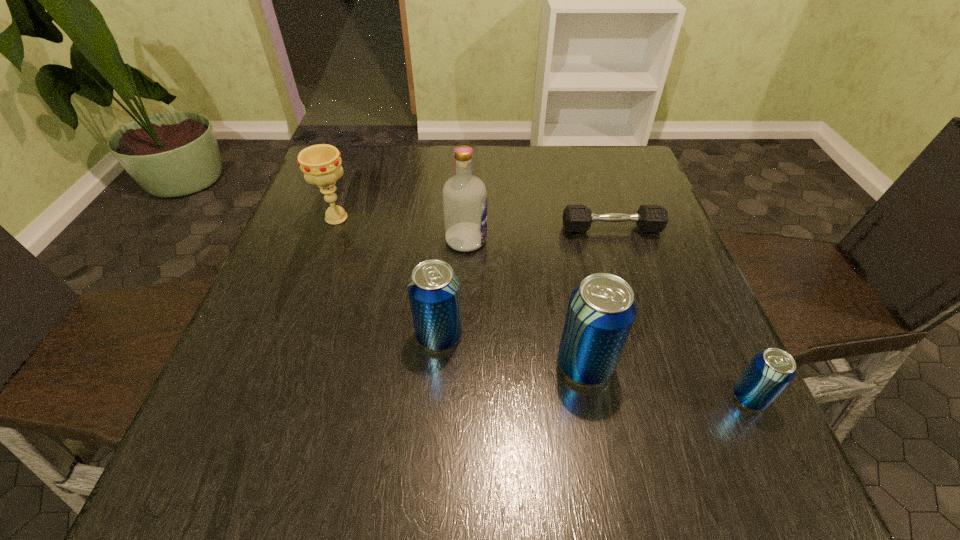
Locate an element on the screen. blank region between the second tallest beer can and the second beer can from right to left is located at coordinates (512, 350).

The image size is (960, 540). What are the coordinates of `the fourth closest object to the leftmost object` in the screenshot? It's located at (601, 311).

Locate which object ranks third in proximity to the leftmost beer can. Please provide its 2D coordinates. Your answer should be formatted as a tuple, i.e. [(x, y)], where the tuple contains the x and y coordinates of a point satisfying the conditions above.

[(321, 164)]

You are a GUI agent. You are given a task and a screenshot of the screen. Output one action in this format:
    pyautogui.click(x=<x>, y=<y>)
    Task: Click on the beer can that is the third closest to the shortest object
    
    Given the screenshot: What is the action you would take?
    pyautogui.click(x=770, y=371)

Select which beer can appears as the closest to the second shortest beer can. Please provide its 2D coordinates. Your answer should be formatted as a tuple, i.e. [(x, y)], where the tuple contains the x and y coordinates of a point satisfying the conditions above.

[(601, 311)]

Where is `vacant space that satisfies the following two spatial constraints: 1. on the front side of the second shortest beer can; 2. on the left side of the leftmost object`? Image resolution: width=960 pixels, height=540 pixels. vacant space that satisfies the following two spatial constraints: 1. on the front side of the second shortest beer can; 2. on the left side of the leftmost object is located at coordinates (294, 335).

Find the location of a particular element. Image resolution: width=960 pixels, height=540 pixels. vacant region that satisfies the following two spatial constraints: 1. on the label of the vodka; 2. on the back side of the shortest beer can is located at coordinates (461, 397).

Locate an element on the screen. The width and height of the screenshot is (960, 540). vacant region that satisfies the following two spatial constraints: 1. on the back side of the second tallest beer can; 2. on the left side of the shortest object is located at coordinates (447, 229).